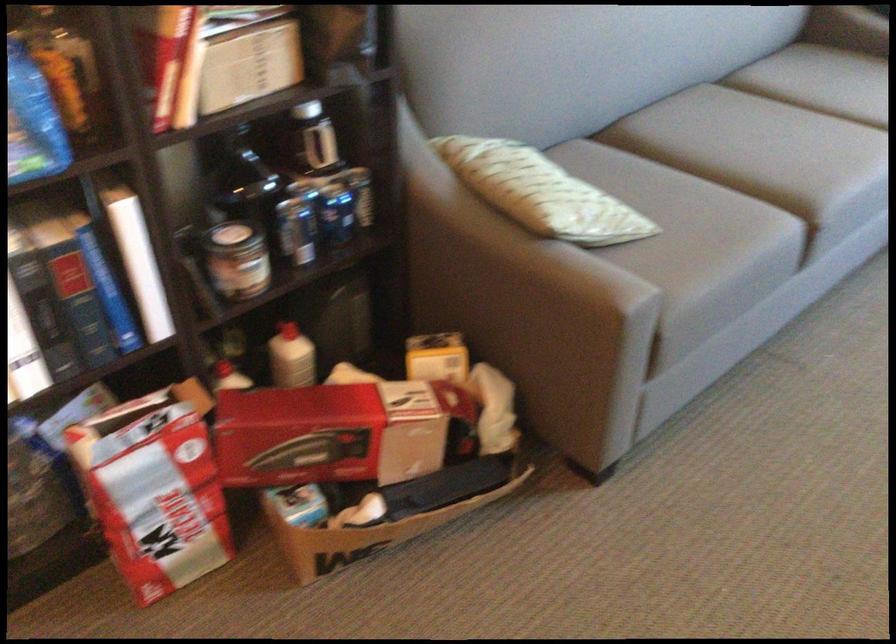
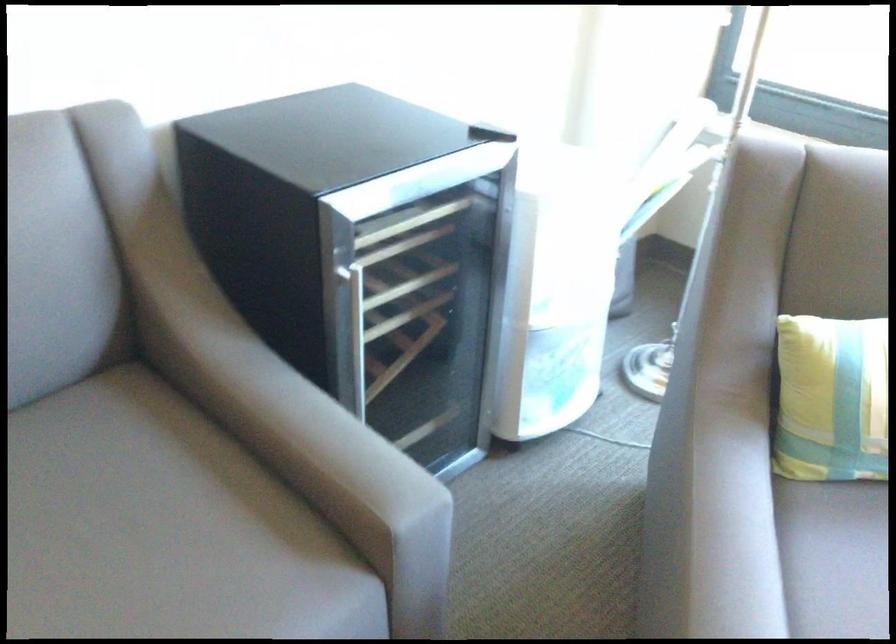
In the second image, find the point that corresponds to [821,93] in the first image.

(83, 529)